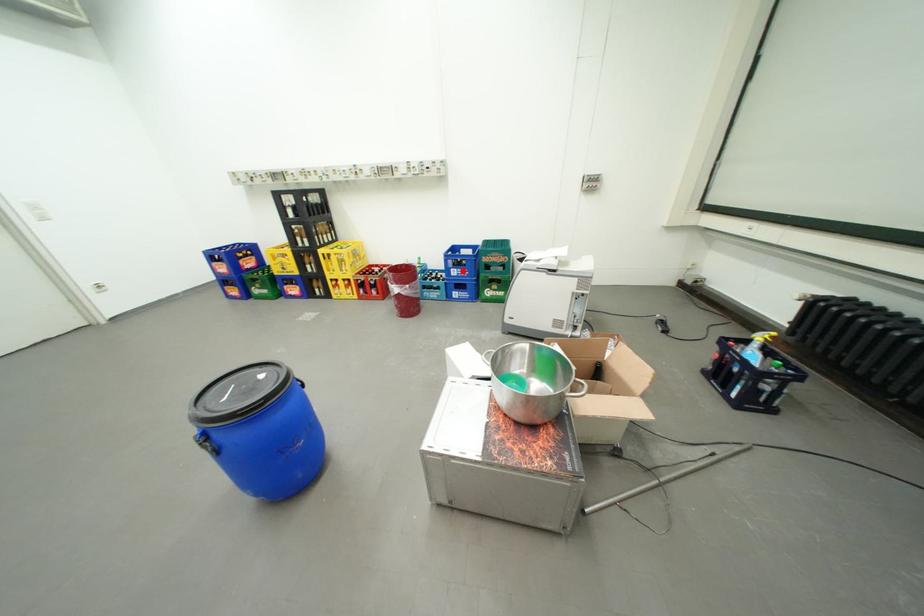
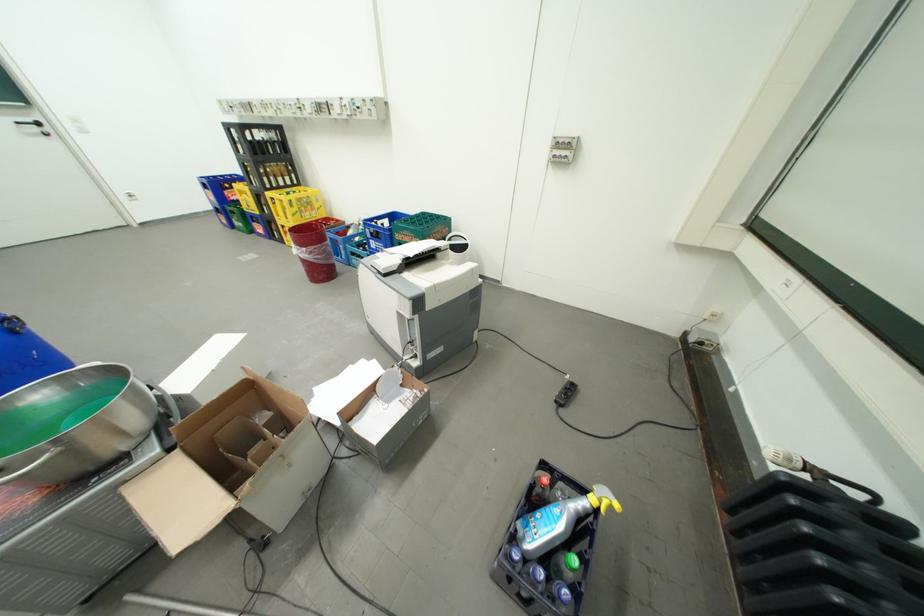
Question: I am providing you with two images of the same scene from different viewpoints. A red point is shown in image1. For the corresponding object point in image2, is it positioned nearer or farther from the camera?

Choices:
 (A) Nearer
 (B) Farther

Answer: (B)